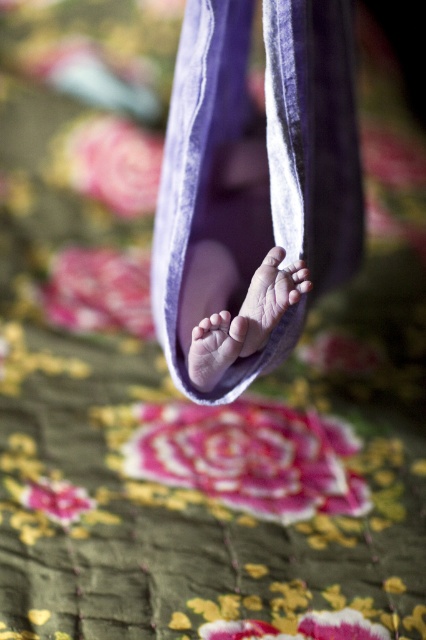
You are a photographer trying to capture the baby feet in the purple hammock. You need to ensure the pink soft skin at center and the matte pink toe at center are both in focus. Which part should you focus on to ensure both are sharp?

Since the pink soft skin at center is much taller than the matte pink toe at center, focusing on the pink soft skin at center will ensure both areas are in focus as the taller object will have a larger depth of field.

You are a photographer trying to capture the baby feet in the purple hammock. You want to ensure that both the pink soft skin at center and the matte pink toe at center are in focus. Which part should you focus on to ensure the wider area is captured?

You should focus on the pink soft skin at center because its width is larger than the matte pink toe at center, allowing for a wider area to be in focus.